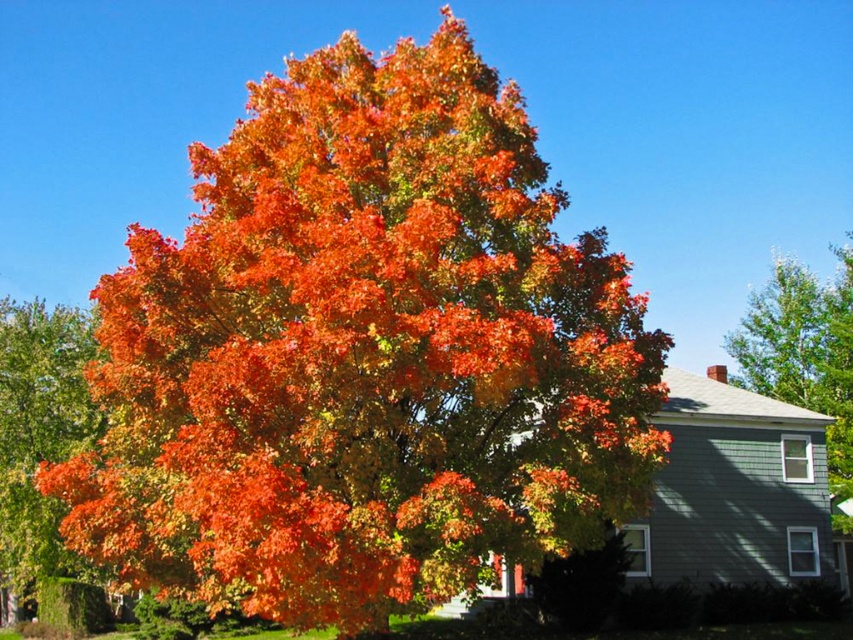
Who is taller, shiny orange leaves at center or orange leafy tree at center?

With more height is shiny orange leaves at center.

Between point (538, 356) and point (28, 451), which one is positioned in front?

Point (538, 356) is in front.

Where is `shiny orange leaves at center`? This screenshot has height=640, width=853. shiny orange leaves at center is located at coordinates (363, 355).

Is point (480, 356) positioned behind point (744, 316)?

No, (480, 356) is in front of (744, 316).

Is shiny orange leaves at center thinner than green leafy tree at upper right?

Yes.

The width and height of the screenshot is (853, 640). Identify the location of shiny orange leaves at center. (363, 355).

Between orange leafy tree at center and green leafy tree at upper right, which one has less height?

orange leafy tree at center

Can you confirm if orange leafy tree at center is smaller than green leafy tree at upper right?

Actually, orange leafy tree at center might be larger than green leafy tree at upper right.

I want to click on orange leafy tree at center, so click(x=39, y=435).

At what (x,y) coordinates should I click in order to perform the action: click on orange leafy tree at center. Please return your answer as a coordinate pair (x, y). The image size is (853, 640). Looking at the image, I should click on (39, 435).